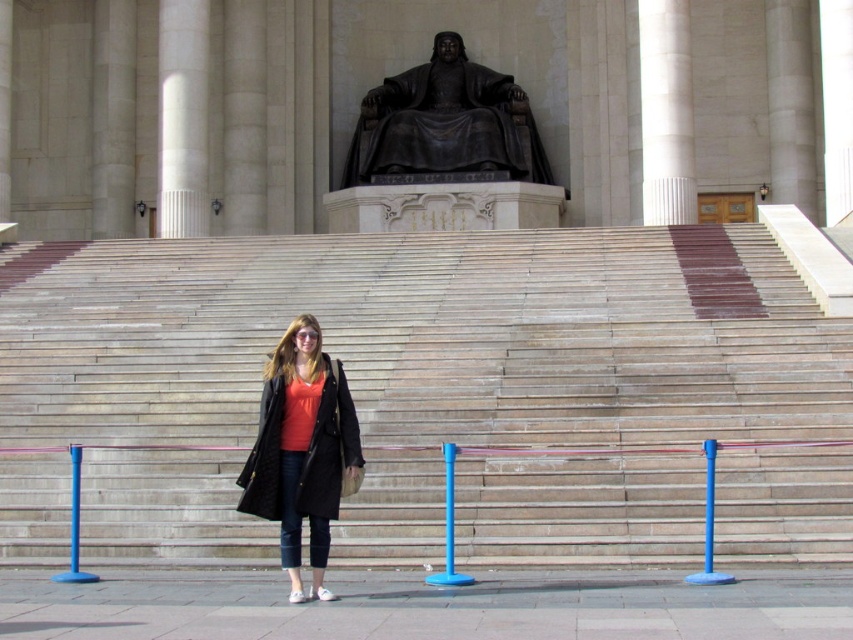
You are standing in front of the grand structure and want to take a photo. You notice two points marked in the scene. Which of the two points, point [531,129] or point [662,141], is closer to your camera position?

Point [531,129] is further to the camera than point [662,141], so the point closer to the camera is point [662,141].

You are a photographer setting up for a group photo at the front of the grand structure. You want to ensure that the black polished stone statue at upper center and the white marble column at upper center are both visible in the frame. Considering their sizes, which object should you position closer to the camera to balance their apparent sizes in the photo?

The black polished stone statue at upper center is larger than the white marble column at upper center. To balance their apparent sizes, position the white marble column at upper center closer to the camera since it is smaller, so it appears larger in the frame, while keeping the statue further back to reduce its dominance.